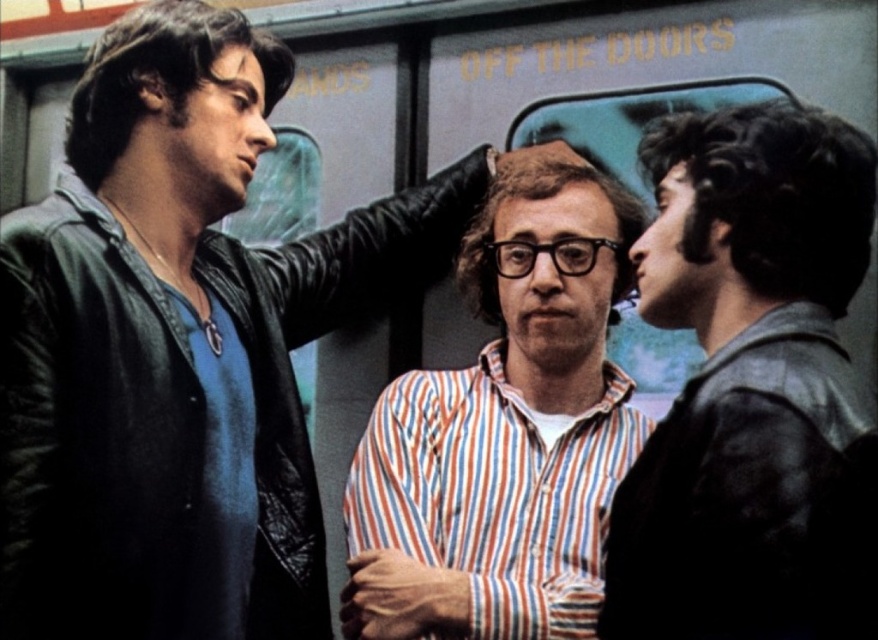
Question: Does matte black leather jacket at left appear on the right side of dark gray leather jacket at right?

Choices:
 (A) yes
 (B) no

Answer: (B)

Question: Is matte black leather jacket at left positioned at the back of dark gray leather jacket at right?

Choices:
 (A) no
 (B) yes

Answer: (B)

Question: Among these objects, which one is farthest from the camera?

Choices:
 (A) dark gray leather jacket at right
 (B) matte black leather jacket at left
 (C) striped cotton shirt at center

Answer: (C)

Question: Based on their relative distances, which object is farther from the striped cotton shirt at center?

Choices:
 (A) dark gray leather jacket at right
 (B) matte black leather jacket at left

Answer: (A)

Question: Is matte black leather jacket at left further to the viewer compared to dark gray leather jacket at right?

Choices:
 (A) yes
 (B) no

Answer: (A)

Question: Which of the following is the closest to the observer?

Choices:
 (A) (284, 381)
 (B) (445, 566)

Answer: (B)